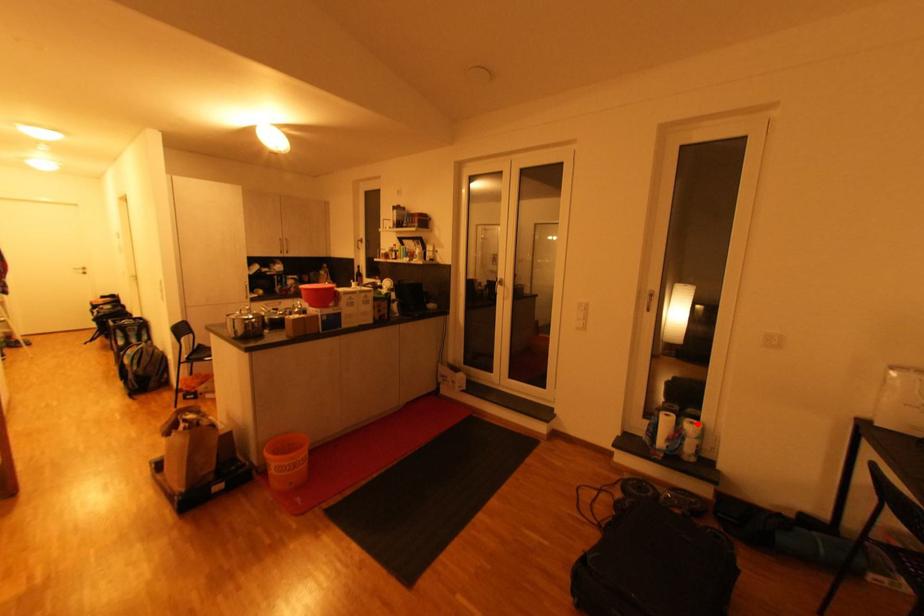
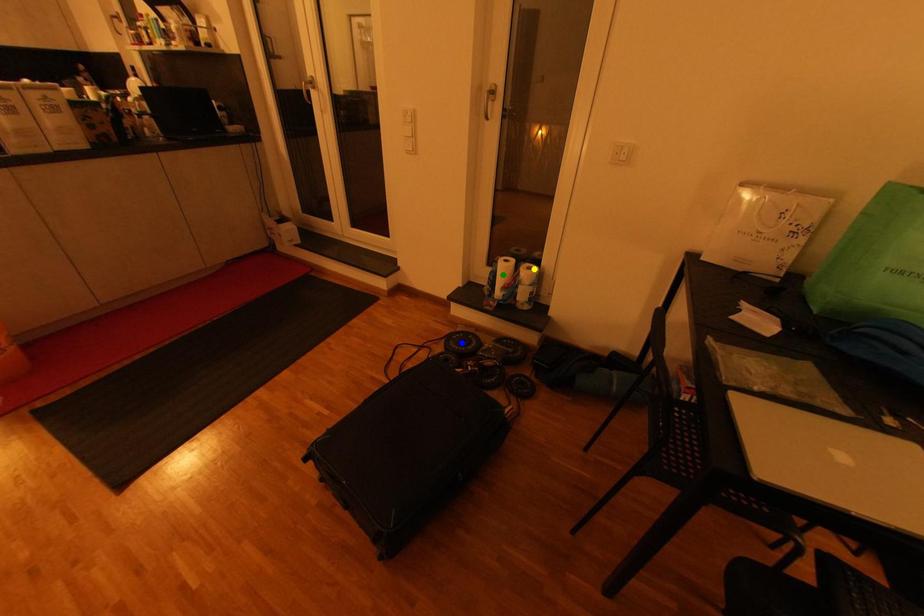
Question: I am providing you with two images of the same scene from different viewpoints. A red point is marked on the first image. You are given multiple points on the second image. Which spot in image 2 lines up with the point in image 1?

Choices:
 (A) yellow point
 (B) green point
 (C) blue point

Answer: (A)